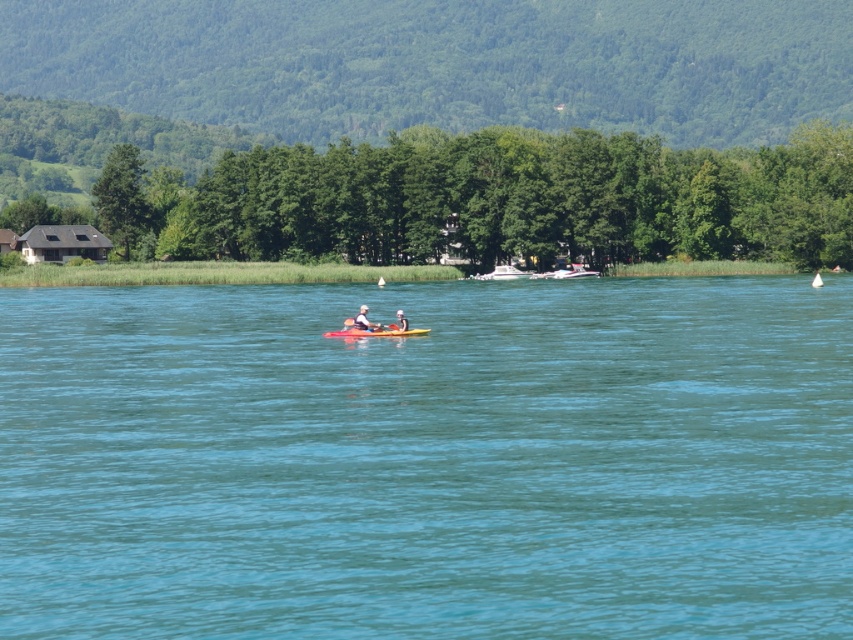
You are a photographer planning to take a wide shot of the yellow plastic kayak at center and the green leafy trees at center. Which object will appear bigger in your photo?

The green leafy trees at center will appear bigger in the photo because they are larger in size than the yellow plastic kayak at center.

You are standing on the lakeside and looking at the green leafy trees at center and the yellow plastic kayak at center. Which object is taller?

The green leafy trees at center are taller than the yellow plastic kayak at center.